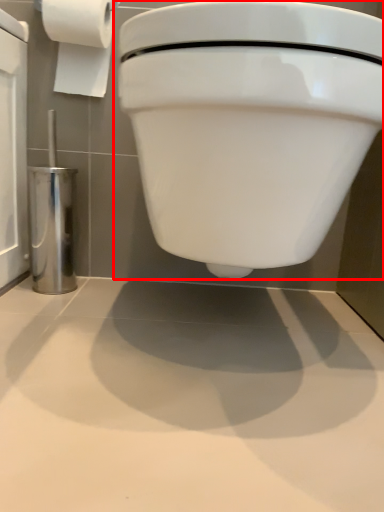
Question: Considering the relative positions of toilet (annotated by the red box) and toilet paper in the image provided, where is toilet (annotated by the red box) located with respect to the staircase?

Choices:
 (A) left
 (B) right

Answer: (B)